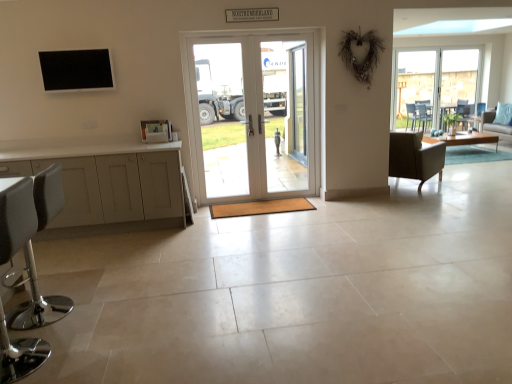
Question: From a real-world perspective, is light blue fabric couch at right on top of white glossy door at center?

Choices:
 (A) yes
 (B) no

Answer: (B)

Question: Does light blue fabric couch at right have a greater height compared to white glossy door at center?

Choices:
 (A) yes
 (B) no

Answer: (B)

Question: Is light blue fabric couch at right bigger than white glossy door at center?

Choices:
 (A) yes
 (B) no

Answer: (A)

Question: Can you confirm if light blue fabric couch at right is shorter than white glossy door at center?

Choices:
 (A) no
 (B) yes

Answer: (B)

Question: Is light blue fabric couch at right smaller than white glossy door at center?

Choices:
 (A) yes
 (B) no

Answer: (B)

Question: From their relative heights in the image, would you say clear glass door at center, which appears as the 2th screen door when viewed from the left, is taller or shorter than white leather stool at lower left, the second chair in the right-to-left sequence?

Choices:
 (A) tall
 (B) short

Answer: (A)

Question: Considering the positions of clear glass door at center, which appears as the 2th screen door when viewed from the left, and white leather stool at lower left, the second chair in the right-to-left sequence, in the image, is clear glass door at center, which appears as the 2th screen door when viewed from the left, bigger or smaller than white leather stool at lower left, the second chair in the right-to-left sequence,?

Choices:
 (A) big
 (B) small

Answer: (B)

Question: Considering the positions of point (285, 127) and point (45, 321), is point (285, 127) closer or farther from the camera than point (45, 321)?

Choices:
 (A) farther
 (B) closer

Answer: (A)

Question: From the image's perspective, is clear glass door at center, the first screen door positioned from the right, positioned above or below white leather stool at lower left, placed as the 1th chair when sorted from front to back?

Choices:
 (A) below
 (B) above

Answer: (B)

Question: Is point (10, 173) closer or farther from the camera than point (212, 193)?

Choices:
 (A) farther
 (B) closer

Answer: (B)

Question: In terms of width, does matte gray cabinet at left look wider or thinner when compared to white glossy door at center?

Choices:
 (A) thin
 (B) wide

Answer: (B)

Question: Considering their positions, is matte gray cabinet at left located in front of or behind white glossy door at center?

Choices:
 (A) front
 (B) behind

Answer: (A)

Question: From a real-world perspective, is matte gray cabinet at left physically located above or below white glossy door at center?

Choices:
 (A) below
 (B) above

Answer: (A)

Question: Is white glossy door at center taller or shorter than clear glass door at center, arranged as the second screen door when viewed from the right?

Choices:
 (A) tall
 (B) short

Answer: (A)

Question: Relative to clear glass door at center, arranged as the second screen door when viewed from the right, is white glossy door at center in front or behind?

Choices:
 (A) front
 (B) behind

Answer: (A)